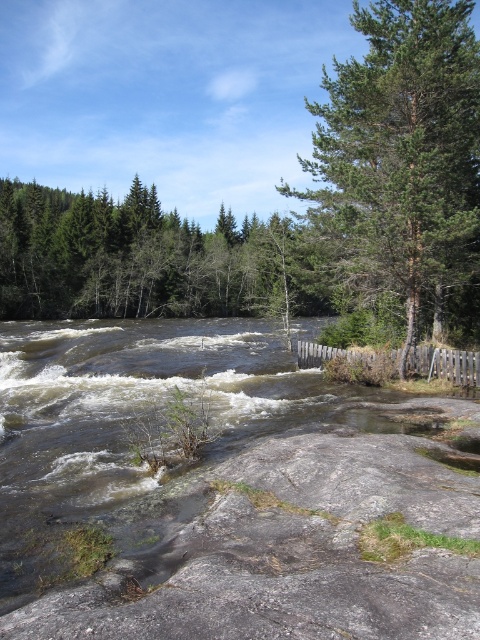
You are standing at the edge of the river and want to cross to the other side. You see a gray rough rock at center and a green textured tree at upper right. Which object is closer to your current position?

The gray rough rock at center is closer to your current position because it is located below the green textured tree at upper right, meaning it is positioned lower in the scene and thus nearer to the riverbank where you are standing.

You are standing on the large flat rock in the foreground of the river scene. Looking up, you notice two trees in the background. Which tree, the green textured tree at upper right or the green matte tree at upper left, is positioned higher in the image?

The green textured tree at upper right is positioned higher in the image than the green matte tree at upper left.

You are standing on the large flat rock in the foreground of the river scene. Looking towards the upper right corner of the image, can you see the green textured tree at upper right? Please state its position using coordinates.

Yes, the green textured tree at upper right is located at coordinates point (402, 150).